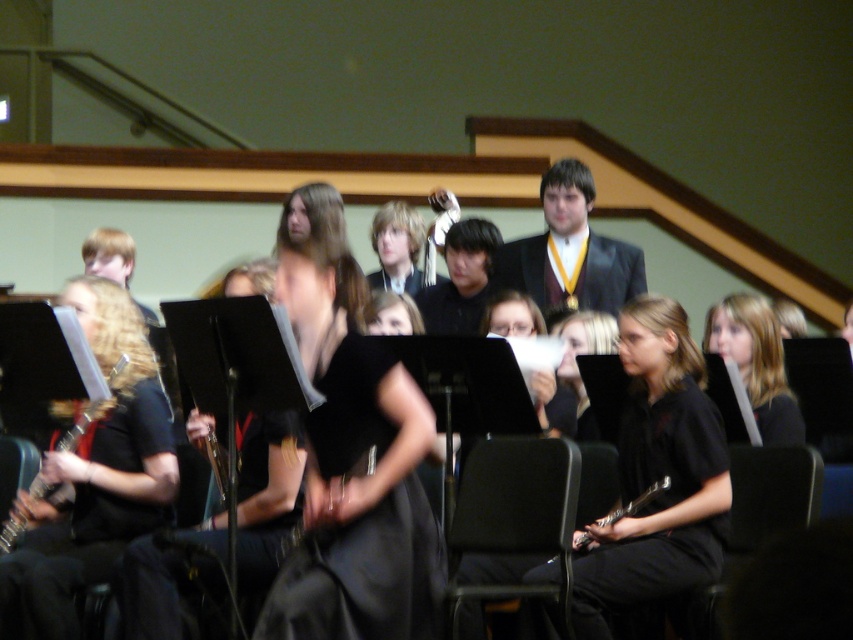
Is point (80, 282) farther from viewer compared to point (10, 538)?

Yes, point (80, 282) is behind point (10, 538).

Does matte black saxophone at left have a lesser width compared to wooden saxophone at left?

No, matte black saxophone at left is not thinner than wooden saxophone at left.

The height and width of the screenshot is (640, 853). Describe the element at coordinates (93, 477) in the screenshot. I see `matte black saxophone at left` at that location.

The image size is (853, 640). I want to click on matte black saxophone at left, so click(93, 477).

Is matte black saxophone at left further to camera compared to metallic brass flute at center?

No.

Between point (132, 476) and point (223, 506), which one is positioned in front?

Point (132, 476) is in front.

Image resolution: width=853 pixels, height=640 pixels. Identify the location of matte black saxophone at left. (93, 477).

Which is more to the left, black fabric chair at center or shiny gold medal at upper center?

black fabric chair at center is more to the left.

At what (x,y) coordinates should I click in order to perform the action: click on black fabric chair at center. Please return your answer as a coordinate pair (x, y). Looking at the image, I should click on (511, 524).

Where is `black fabric chair at center`? This screenshot has width=853, height=640. black fabric chair at center is located at coordinates (511, 524).